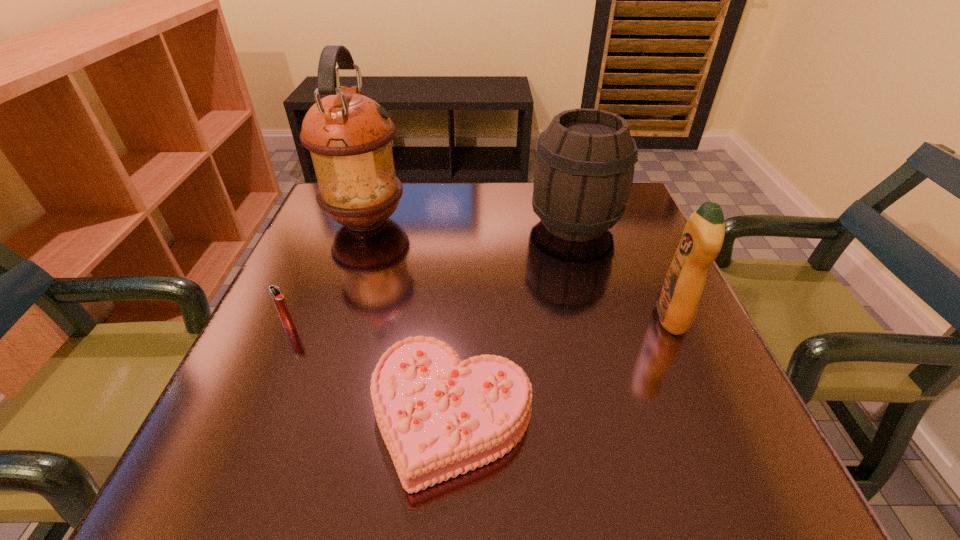
Find the location of `free space located on the label of the detergent`. free space located on the label of the detergent is located at coordinates (608, 318).

Where is `free location located on the back of the second shortest object`? free location located on the back of the second shortest object is located at coordinates (323, 248).

This screenshot has width=960, height=540. In order to click on free space located on the right of the shortest object in this screenshot , I will do `click(604, 416)`.

Where is `oil lamp at the far edge`? This screenshot has width=960, height=540. oil lamp at the far edge is located at coordinates (349, 135).

What are the coordinates of `wine bucket present at the far edge` in the screenshot? It's located at (584, 169).

This screenshot has width=960, height=540. I want to click on object present at the near edge, so click(439, 417).

At what (x,y) coordinates should I click in order to perform the action: click on oil lamp present at the left edge. Please return your answer as a coordinate pair (x, y). Looking at the image, I should click on (349, 135).

Locate an element on the screen. igniter that is at the left edge is located at coordinates (279, 301).

Locate an element on the screen. The image size is (960, 540). wine bucket present at the right edge is located at coordinates (584, 169).

Locate an element on the screen. detergent positioned at the right edge is located at coordinates (702, 239).